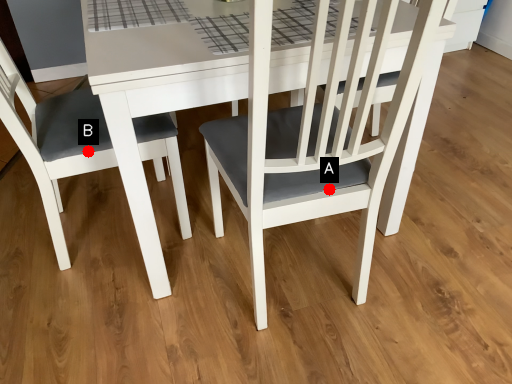
Question: Two points are circled on the image, labeled by A and B beside each circle. Which of the following is the farthest from the observer?

Choices:
 (A) A is further
 (B) B is further

Answer: (B)